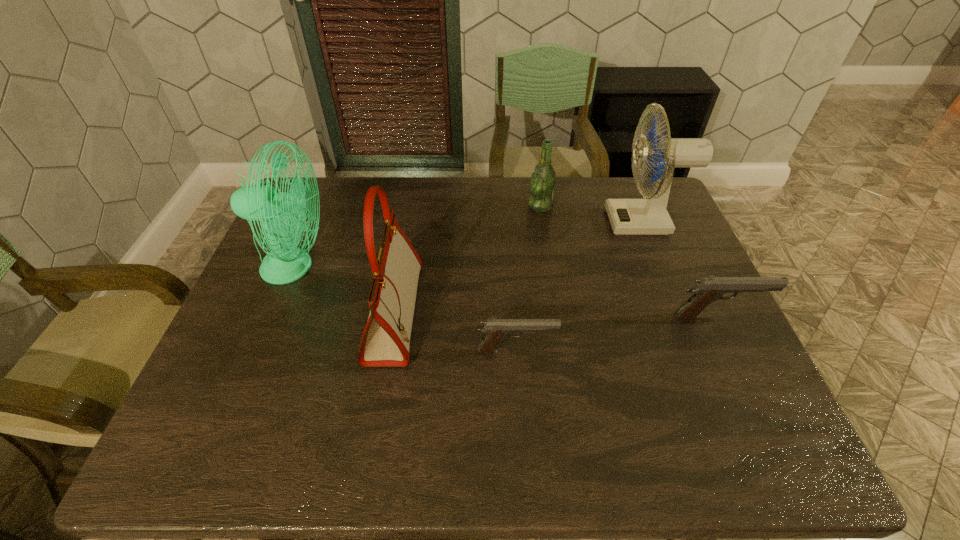
All pistols are currently evenly spaced. To continue this pattern, where would you add another pistol on the left? Please point out a vacant spot. Please provide its 2D coordinates. Your answer should be formatted as a tuple, i.e. [(x, y)], where the tuple contains the x and y coordinates of a point satisfying the conditions above.

[(283, 391)]